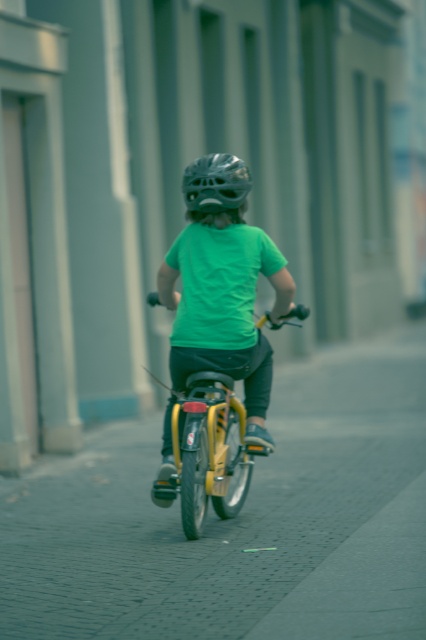
Based on the photo, between cobblestone pavement at center and shiny metallic helmet at center, which one is positioned higher?

shiny metallic helmet at center

Between cobblestone pavement at center and shiny metallic helmet at center, which one has less height?

With less height is shiny metallic helmet at center.

What are the coordinates of `cobblestone pavement at center` in the screenshot? It's located at (238, 522).

Does cobblestone pavement at center have a greater height compared to yellow matte bicycle at center?

In fact, cobblestone pavement at center may be shorter than yellow matte bicycle at center.

Is cobblestone pavement at center to the right of yellow matte bicycle at center from the viewer's perspective?

Yes, cobblestone pavement at center is to the right of yellow matte bicycle at center.

The height and width of the screenshot is (640, 426). What do you see at coordinates (238, 522) in the screenshot?
I see `cobblestone pavement at center` at bounding box center [238, 522].

Image resolution: width=426 pixels, height=640 pixels. I want to click on cobblestone pavement at center, so click(x=238, y=522).

Between point (216, 424) and point (226, 152), which one is positioned behind?

The point (226, 152) is behind.

Does yellow matte bicycle at center have a smaller size compared to shiny metallic helmet at center?

Incorrect, yellow matte bicycle at center is not smaller in size than shiny metallic helmet at center.

Describe the element at coordinates (209, 451) in the screenshot. I see `yellow matte bicycle at center` at that location.

Locate an element on the screen. yellow matte bicycle at center is located at coordinates (209, 451).